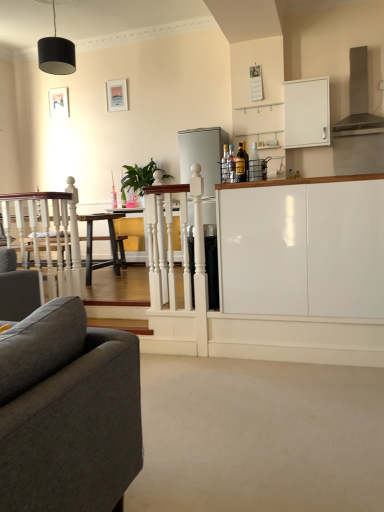
Question: Is matte white picture frame at upper center, the 1th picture frame when ordered from right to left, taller or shorter than matte gray exhaust hood at upper right?

Choices:
 (A) tall
 (B) short

Answer: (B)

Question: Looking at their shapes, would you say matte white picture frame at upper center, which appears as the second picture frame when viewed from the back, is wider or thinner than matte gray exhaust hood at upper right?

Choices:
 (A) wide
 (B) thin

Answer: (B)

Question: Considering the real-world distances, which object is closest to the white glossy cabinet at upper right, which appears as the 2th cabinetry when ordered from the bottom?

Choices:
 (A) satin silver refrigerator at center
 (B) black matte lampshade at upper center
 (C) white glossy table at center
 (D) white glossy cabinet at center, placed as the first cabinetry when sorted from front to back
 (E) matte white picture frame at upper left, the first picture frame when ordered from back to front

Answer: (A)

Question: Estimate the real-world distances between objects in this image. Which object is farther from the matte gray exhaust hood at upper right?

Choices:
 (A) white glossy cabinet at center, placed as the first cabinetry when sorted from front to back
 (B) white wooden railing at center
 (C) satin silver refrigerator at center
 (D) black matte lampshade at upper center
 (E) matte white picture frame at upper center, the second picture frame from the left

Answer: (D)